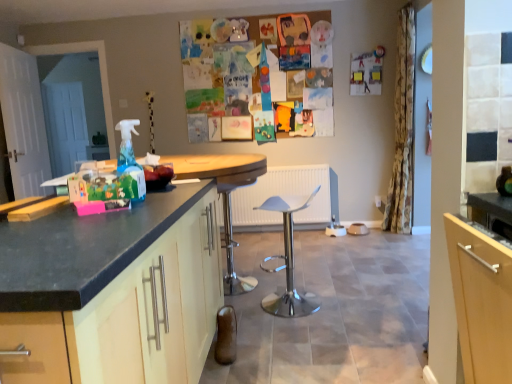
Image resolution: width=512 pixels, height=384 pixels. What do you see at coordinates (224, 196) in the screenshot?
I see `wooden round table at center` at bounding box center [224, 196].

The image size is (512, 384). I want to click on white wooden door at left, so 24,122.

The image size is (512, 384). Describe the element at coordinates (402, 130) in the screenshot. I see `floral fabric curtain at right` at that location.

What is the approximate width of floral fabric curtain at right?

27.54 centimeters.

What are the coordinates of `matte wood cabinet at left` in the screenshot? It's located at (113, 292).

From a real-world perspective, which is physically below, white wooden door at left or white glossy swivel chair at center?

white glossy swivel chair at center.

Which object is thinner, white wooden door at left or white glossy swivel chair at center?

With smaller width is white wooden door at left.

Identify the location of swivel chair located in front of the white wooden door at left. Image resolution: width=512 pixels, height=384 pixels. (288, 261).

Is white wooden door at left surrounding white glossy swivel chair at center?

Actually, white glossy swivel chair at center is outside white wooden door at left.

From the image's perspective, is white wooden door at left above wooden round table at center?

Yes, from the image's perspective, white wooden door at left is over wooden round table at center.

Considering the positions of point (33, 147) and point (211, 177), is point (33, 147) closer or farther from the camera than point (211, 177)?

Clearly, point (33, 147) is more distant from the camera than point (211, 177).

Is white wooden door at left to the left or to the right of wooden round table at center in the image?

In the image, white wooden door at left appears on the left side of wooden round table at center.

In the scene shown: Considering their positions, is white wooden door at left located in front of or behind wooden round table at center?

Clearly, white wooden door at left is behind wooden round table at center.

Is matte wood cabinet at left at the back of white wooden door at left?

No, white wooden door at left's orientation is not away from matte wood cabinet at left.

In terms of height, does white wooden door at left look taller or shorter compared to matte wood cabinet at left?

white wooden door at left is taller than matte wood cabinet at left.

Between white wooden door at left and matte wood cabinet at left, which one has larger width?

With larger width is matte wood cabinet at left.

Considering the sizes of objects white wooden door at left and matte wood cabinet at left in the image provided, who is smaller, white wooden door at left or matte wood cabinet at left?

Smaller between the two is white wooden door at left.

Is floral fabric curtain at right further to the viewer compared to white wooden door at left?

No, floral fabric curtain at right is in front of white wooden door at left.

From the image's perspective, which one is positioned higher, floral fabric curtain at right or white wooden door at left?

white wooden door at left is shown above in the image.

Which of these two, floral fabric curtain at right or white wooden door at left, stands taller?

With more height is floral fabric curtain at right.

The height and width of the screenshot is (384, 512). Identify the location of bar stool in front of the floral fabric curtain at right. (232, 234).

Is white plastic stool at center touching floral fabric curtain at right?

No, white plastic stool at center is not in contact with floral fabric curtain at right.

Is white plastic stool at center wider or thinner than floral fabric curtain at right?

Considering their sizes, white plastic stool at center looks broader than floral fabric curtain at right.

From a real-world perspective, is white plastic stool at center on floral fabric curtain at right?

No, from a real-world perspective, white plastic stool at center is not above floral fabric curtain at right.

From a real-world perspective, relative to white plastic stool at center, is white wooden door at left vertically above or below?

white wooden door at left is situated higher than white plastic stool at center in the real world.

Considering the relative positions of white wooden door at left and white plastic stool at center in the image provided, is white wooden door at left behind white plastic stool at center?

Yes, it is behind white plastic stool at center.

Is white wooden door at left shorter than white plastic stool at center?

No, white wooden door at left is not shorter than white plastic stool at center.

Is matte wood cabinet at left not near floral fabric curtain at right?

Absolutely, matte wood cabinet at left is distant from floral fabric curtain at right.

Find the location of a particular element. This screenshot has height=384, width=512. curtain behind the matte wood cabinet at left is located at coordinates (402, 130).

From the image's perspective, which is above, matte wood cabinet at left or floral fabric curtain at right?

From the image's view, floral fabric curtain at right is above.

Can you confirm if matte wood cabinet at left is smaller than floral fabric curtain at right?

No.

Find the location of a particular element. Image resolution: width=512 pixels, height=384 pixels. swivel chair located below the white wooden door at left (from the image's perspective) is located at coordinates [x=288, y=261].

The width and height of the screenshot is (512, 384). In order to click on screen door behind the wooden round table at center in this screenshot , I will do `click(24, 122)`.

Looking at the image, which one is located further to white plastic stool at center, white wooden door at left or floral fabric curtain at right?

white wooden door at left lies further to white plastic stool at center than the other object.

Estimate the real-world distances between objects in this image. Which object is further from white wooden door at left, matte wood cabinet at left or white plastic stool at center?

matte wood cabinet at left lies further to white wooden door at left than the other object.

From the image, which object appears to be nearer to floral fabric curtain at right, matte wood cabinet at left or wooden round table at center?

Among the two, wooden round table at center is located nearer to floral fabric curtain at right.

Looking at the image, which one is located further to white plastic stool at center, floral fabric curtain at right or wooden round table at center?

Among the two, floral fabric curtain at right is located further to white plastic stool at center.

Estimate the real-world distances between objects in this image. Which object is closer to white wooden door at left, matte wood cabinet at left or white glossy swivel chair at center?

Based on the image, white glossy swivel chair at center appears to be nearer to white wooden door at left.

Estimate the real-world distances between objects in this image. Which object is closer to wooden round table at center, white glossy swivel chair at center or floral fabric curtain at right?

white glossy swivel chair at center.

Estimate the real-world distances between objects in this image. Which object is further from floral fabric curtain at right, matte wood cabinet at left or white wooden door at left?

Among the two, white wooden door at left is located further to floral fabric curtain at right.

Estimate the real-world distances between objects in this image. Which object is closer to white wooden door at left, white plastic stool at center or wooden round table at center?

Among the two, white plastic stool at center is located nearer to white wooden door at left.

Identify the location of swivel chair positioned between matte wood cabinet at left and white wooden door at left from near to far. (x=288, y=261).

Locate an element on the screen. The width and height of the screenshot is (512, 384). bar stool situated between white wooden door at left and floral fabric curtain at right from left to right is located at coordinates (232, 234).

Locate an element on the screen. bar stool between matte wood cabinet at left and floral fabric curtain at right in the front-back direction is located at coordinates (232, 234).

At what (x,y) coordinates should I click in order to perform the action: click on round table located between white wooden door at left and white glossy swivel chair at center in the left-right direction. Please return your answer as a coordinate pair (x, y). The width and height of the screenshot is (512, 384). Looking at the image, I should click on (224, 196).